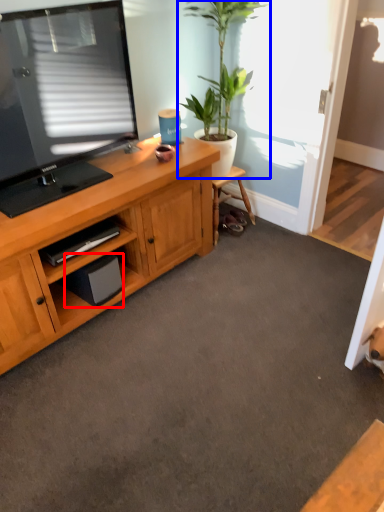
Question: Among these objects, which one is farthest to the camera, speaker (highlighted by a red box) or houseplant (highlighted by a blue box)?

Choices:
 (A) speaker
 (B) houseplant

Answer: (A)